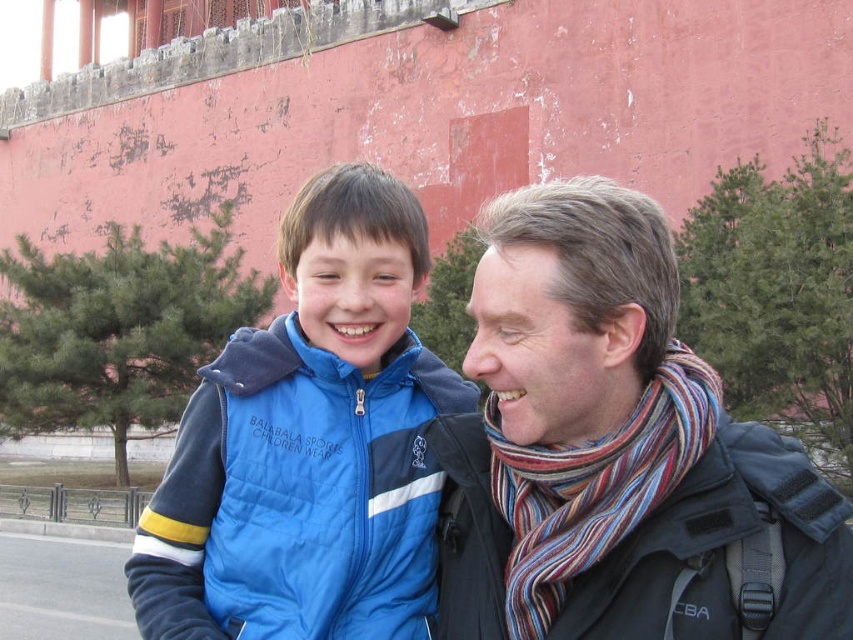
Who is higher up, striped scarf at right or blue quilted vest at center?

striped scarf at right

This screenshot has width=853, height=640. What do you see at coordinates (612, 449) in the screenshot? I see `striped scarf at right` at bounding box center [612, 449].

I want to click on striped scarf at right, so click(x=612, y=449).